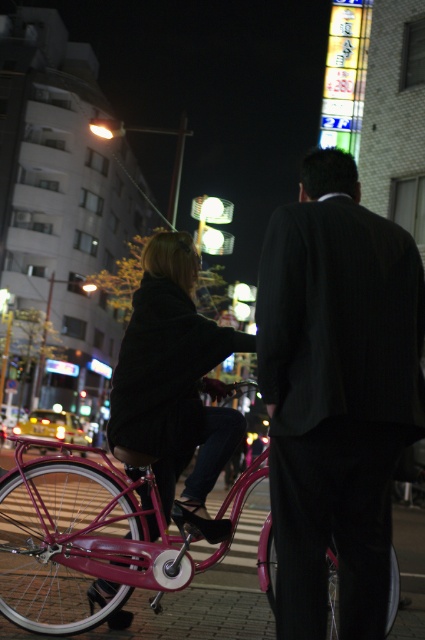
Is dark pinstripe suit at center smaller than matte black coat at center?

Correct, dark pinstripe suit at center occupies less space than matte black coat at center.

Does dark pinstripe suit at center have a lesser height compared to matte black coat at center?

No, dark pinstripe suit at center is not shorter than matte black coat at center.

In order to click on dark pinstripe suit at center in this screenshot , I will do `click(337, 392)`.

Who is positioned more to the left, shiny pink bicycle at center or matte black coat at center?

From the viewer's perspective, shiny pink bicycle at center appears more on the left side.

Is shiny pink bicycle at center thinner than matte black coat at center?

Incorrect, shiny pink bicycle at center's width is not less than matte black coat at center's.

The width and height of the screenshot is (425, 640). What do you see at coordinates (90, 538) in the screenshot? I see `shiny pink bicycle at center` at bounding box center [90, 538].

The image size is (425, 640). I want to click on shiny pink bicycle at center, so click(90, 538).

Consider the image. Can you confirm if dark pinstripe suit at center is smaller than shiny pink bicycle at center?

Correct, dark pinstripe suit at center occupies less space than shiny pink bicycle at center.

Which is in front, point (308, 464) or point (107, 496)?

Point (308, 464)

Is point (285, 230) farther from viewer compared to point (67, 449)?

No, it is not.

At what (x,y) coordinates should I click in order to perform the action: click on dark pinstripe suit at center. Please return your answer as a coordinate pair (x, y). This screenshot has height=640, width=425. Looking at the image, I should click on (337, 392).